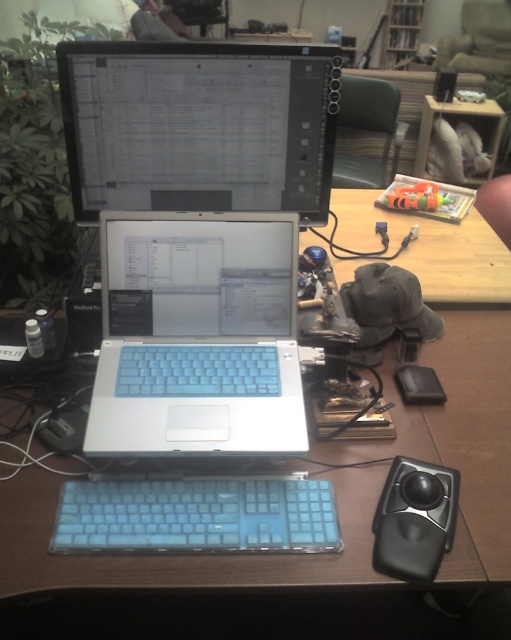
Looking at this image, you are setting up a new monitor on your desk. You have a matte black monitor at upper center and a wooden table at center. Which one has a smaller thickness?

The matte black monitor at upper center is thinner than the wooden table at center.

You are organizing cables in the workspace and need to route a cable from point A to point B. Point A is at coordinate point(469, 435) and point B is at coordinate point(181, 496). Considering the workspace layout, which point is closer to you, the observer, so you can decide the best path for the cable?

Point(469, 435) is closer to the observer than point(181, 496), so you should route the cable starting from point(469, 435) first to ensure it stays visible and accessible.

You are organizing your workspace and need to place a new decorative item on the desk. Considering the current setup, which object would allow more space for the new item when placed on the wooden table at center compared to the matte black monitor at upper center?

The wooden table at center allows more space for the new item because the matte black monitor at upper center occupies less space than the wooden table at center, meaning there is more room available on the wooden table.